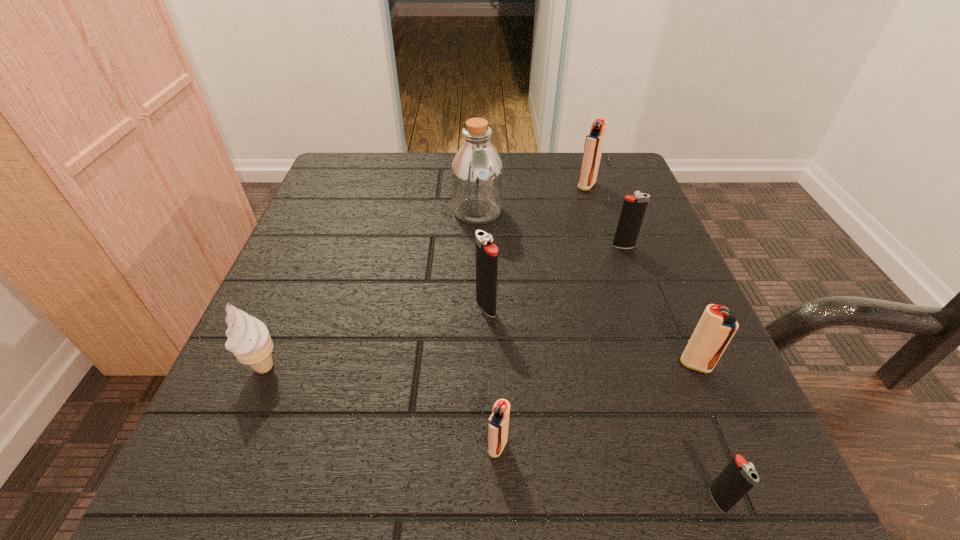
Image resolution: width=960 pixels, height=540 pixels. Find the location of `the rightmost object`. the rightmost object is located at coordinates (715, 329).

Identify the location of the second nearest object. The image size is (960, 540). (498, 423).

Where is `the nearest red igniter`? Image resolution: width=960 pixels, height=540 pixels. the nearest red igniter is located at coordinates (x=498, y=423).

Where is `the nearest object`? The image size is (960, 540). the nearest object is located at coordinates (738, 477).

The width and height of the screenshot is (960, 540). I want to click on the nearest black igniter, so click(x=738, y=477).

Identify the location of free location located on the right of the tallest object. (632, 212).

Where is `free space located on the back of the farthest igniter`? free space located on the back of the farthest igniter is located at coordinates [580, 164].

Identify the location of free space located 0.320m on the back of the leftmost black igniter. This screenshot has width=960, height=540. (485, 192).

Identify the location of vacant space located 0.070m on the front-facing side of the leftmost object. The height and width of the screenshot is (540, 960). (238, 430).

Locate an element on the screen. vacant area situated on the left of the second biggest black igniter is located at coordinates pyautogui.click(x=466, y=246).